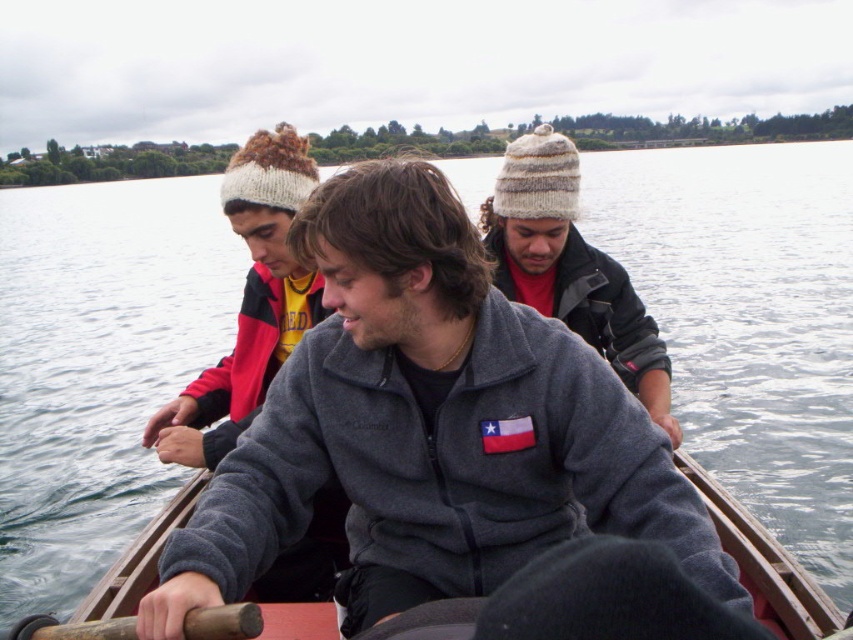
Question: Is knitted wool beanie at upper center above wooden paddle at lower left?

Choices:
 (A) yes
 (B) no

Answer: (A)

Question: Is knitted wool beanie at upper left bigger than wooden paddle at lower left?

Choices:
 (A) no
 (B) yes

Answer: (B)

Question: Can you confirm if wooden canoe at center is wider than wooden paddle at lower left?

Choices:
 (A) no
 (B) yes

Answer: (A)

Question: Which of these objects is positioned closest to the wooden canoe at center?

Choices:
 (A) wooden paddle at lower left
 (B) knitted wool beanie at upper left
 (C) knitted wool beanie at upper center

Answer: (C)

Question: Estimate the real-world distances between objects in this image. Which object is closer to the knitted wool beanie at upper left?

Choices:
 (A) knitted wool beanie at upper center
 (B) wooden paddle at lower left

Answer: (A)

Question: Among these objects, which one is farthest from the camera?

Choices:
 (A) wooden canoe at center
 (B) knitted wool beanie at upper center

Answer: (B)